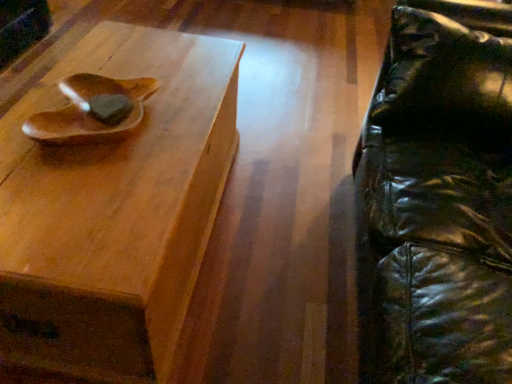
Question: From a real-world perspective, does wooden bowl at upper left stand above wooden tray at upper left?

Choices:
 (A) yes
 (B) no

Answer: (A)

Question: Considering the relative positions of wooden bowl at upper left and wooden tray at upper left in the image provided, is wooden bowl at upper left to the left of wooden tray at upper left from the viewer's perspective?

Choices:
 (A) yes
 (B) no

Answer: (A)

Question: From the image's perspective, would you say wooden bowl at upper left is shown under wooden tray at upper left?

Choices:
 (A) no
 (B) yes

Answer: (A)

Question: Is wooden bowl at upper left outside wooden tray at upper left?

Choices:
 (A) yes
 (B) no

Answer: (A)

Question: From a real-world perspective, is wooden bowl at upper left positioned under wooden tray at upper left based on gravity?

Choices:
 (A) yes
 (B) no

Answer: (B)

Question: Relative to wooden tray at upper left, is wooden bowl at upper left in front or behind?

Choices:
 (A) behind
 (B) front

Answer: (A)

Question: Looking at the image, does wooden bowl at upper left seem bigger or smaller compared to wooden tray at upper left?

Choices:
 (A) small
 (B) big

Answer: (A)

Question: From a real-world perspective, is wooden bowl at upper left physically located above or below wooden tray at upper left?

Choices:
 (A) above
 (B) below

Answer: (A)

Question: Would you say wooden bowl at upper left is to the left or to the right of wooden tray at upper left in the picture?

Choices:
 (A) right
 (B) left

Answer: (B)

Question: Is wooden tray at upper left situated inside wooden bowl at upper left or outside?

Choices:
 (A) inside
 (B) outside

Answer: (B)

Question: From a real-world perspective, is wooden tray at upper left positioned above or below wooden bowl at upper left?

Choices:
 (A) below
 (B) above

Answer: (A)

Question: Relative to wooden bowl at upper left, is wooden tray at upper left in front or behind?

Choices:
 (A) front
 (B) behind

Answer: (A)

Question: In terms of height, does wooden tray at upper left look taller or shorter compared to wooden bowl at upper left?

Choices:
 (A) tall
 (B) short

Answer: (A)

Question: From the image's perspective, is black leather swivel chair at right positioned above or below wooden bowl at upper left?

Choices:
 (A) below
 (B) above

Answer: (A)

Question: Is black leather swivel chair at right in front of or behind wooden bowl at upper left in the image?

Choices:
 (A) front
 (B) behind

Answer: (A)